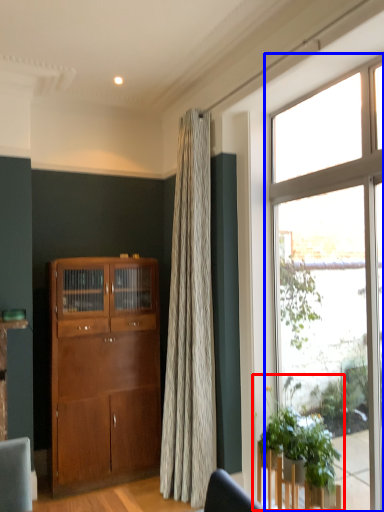
Question: Which object appears closest to the camera in this image, houseplant (highlighted by a red box) or window (highlighted by a blue box)?

Choices:
 (A) houseplant
 (B) window

Answer: (A)